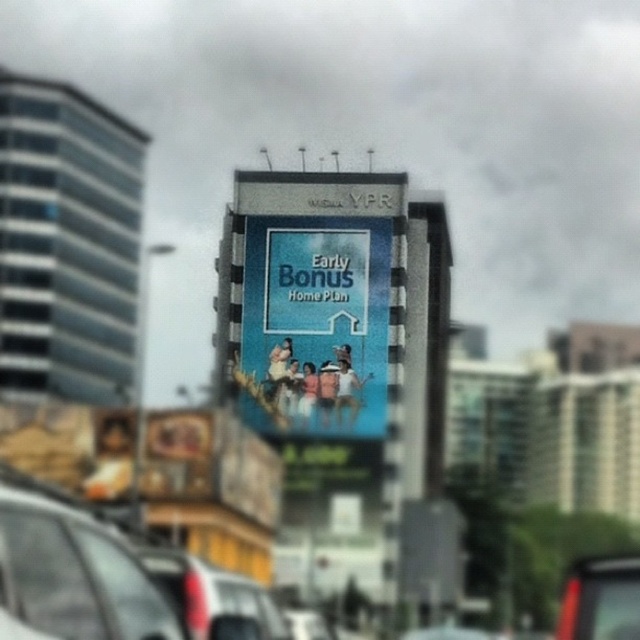
Question: Among these points, which one is nearest to the camera?

Choices:
 (A) (228, 612)
 (B) (307, 266)
 (C) (579, 625)

Answer: (C)

Question: Is blue glossy billboard at center positioned before matte gray car at lower left?

Choices:
 (A) no
 (B) yes

Answer: (A)

Question: Based on their relative distances, which object is nearer to the metallic silver car at center?

Choices:
 (A) matte gray car at lower left
 (B) blue glossy billboard at center

Answer: (A)

Question: Which is farther from the matte black car at lower left?

Choices:
 (A) blue glossy billboard at center
 (B) metallic silver car at center
 (C) matte gray car at lower left

Answer: (A)

Question: Is matte gray car at lower left above matte black car at lower left?

Choices:
 (A) no
 (B) yes

Answer: (B)

Question: Can you confirm if matte gray car at lower left is smaller than metallic silver car at center?

Choices:
 (A) no
 (B) yes

Answer: (B)